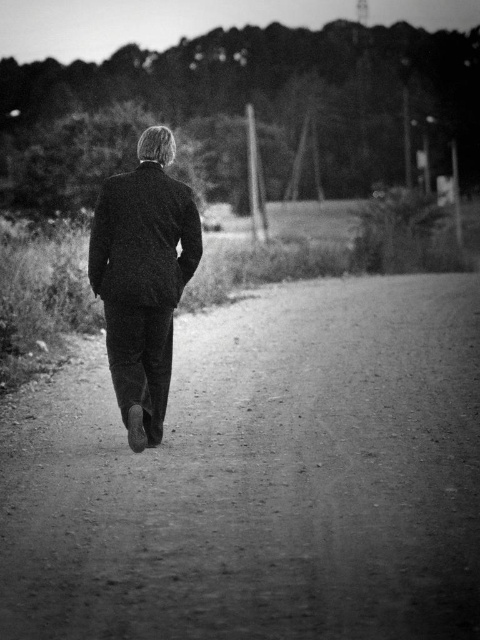
Between point (219, 636) and point (136, 241), which one is positioned behind?

The point (136, 241) is behind.

Between point (60, 451) and point (99, 234), which one is positioned in front?

Point (99, 234)

Which is behind, point (408, 500) or point (129, 410)?

Positioned behind is point (129, 410).

At what (x,y) coordinates should I click in order to perform the action: click on dirt track at center. Please return your answer as a coordinate pair (x, y). Looking at the image, I should click on (261, 477).